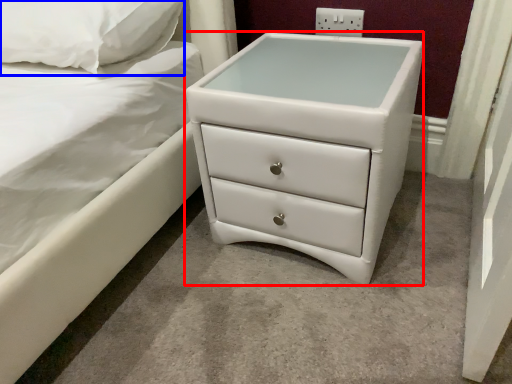
Question: Which of the following is the farthest to the observer, chest of drawers (highlighted by a red box) or pillow (highlighted by a blue box)?

Choices:
 (A) chest of drawers
 (B) pillow

Answer: (B)